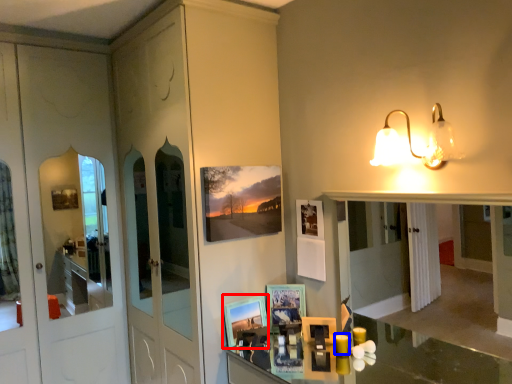
Question: Which of the following is the farthest to the observer, picture frame (highlighted by a red box) or candle (highlighted by a blue box)?

Choices:
 (A) picture frame
 (B) candle

Answer: (A)